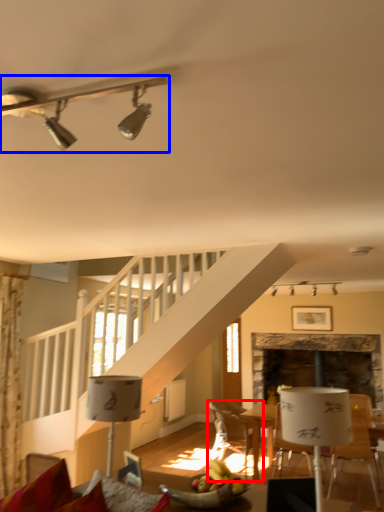
Question: Among these objects, which one is farthest to the camera, chair (highlighted by a red box) or lamp (highlighted by a blue box)?

Choices:
 (A) chair
 (B) lamp

Answer: (A)